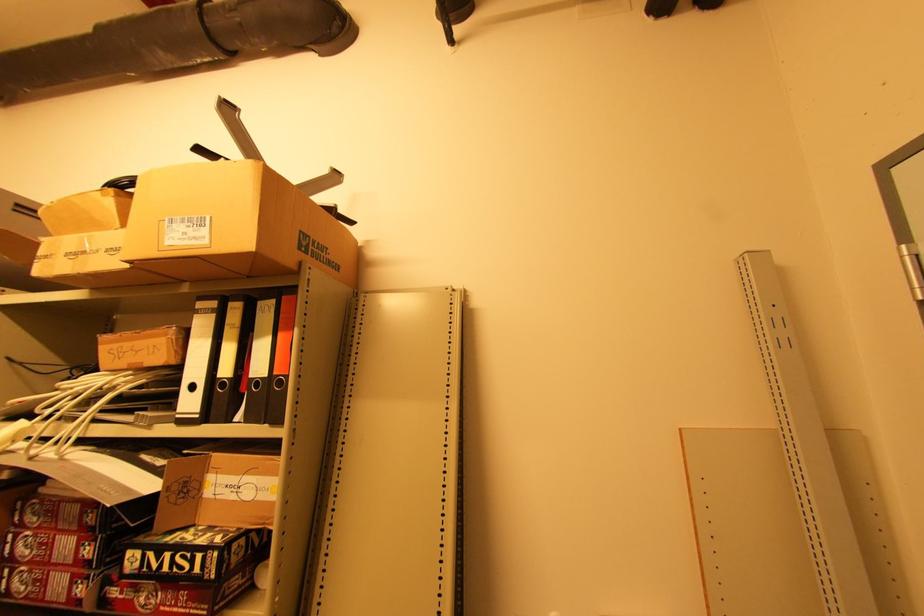
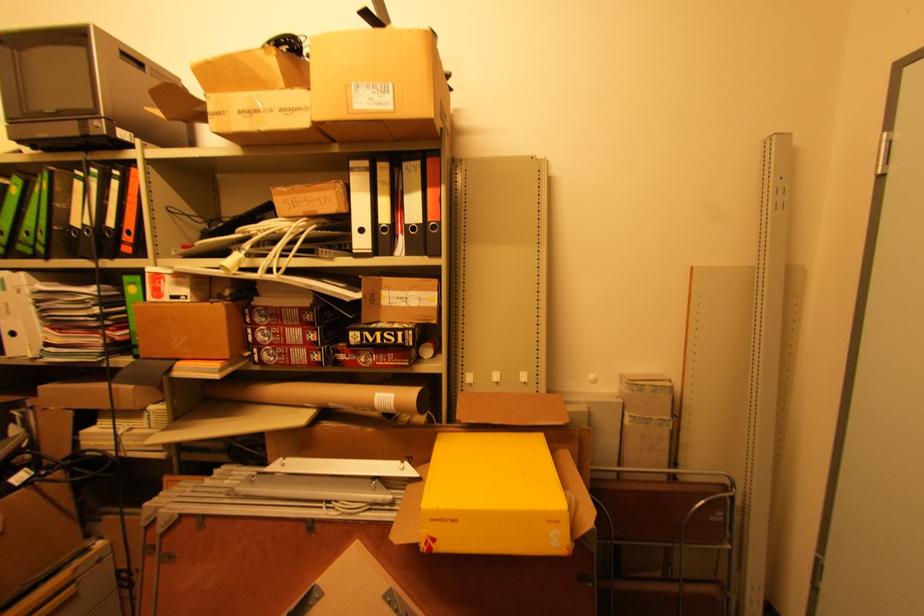
Locate, in the second image, the point that corresponds to (x=172, y=243) in the first image.

(359, 107)